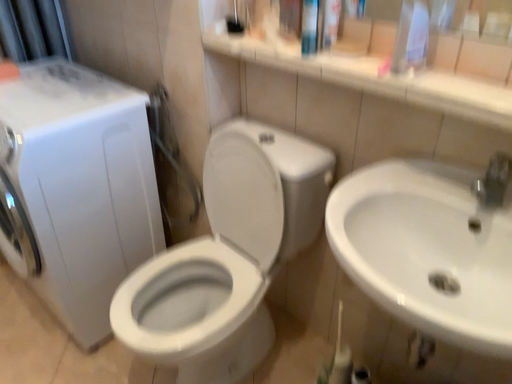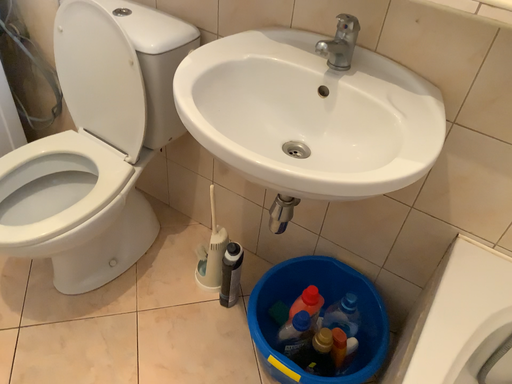
Question: Which way did the camera rotate in the video?

Choices:
 (A) rotated right
 (B) rotated left

Answer: (A)